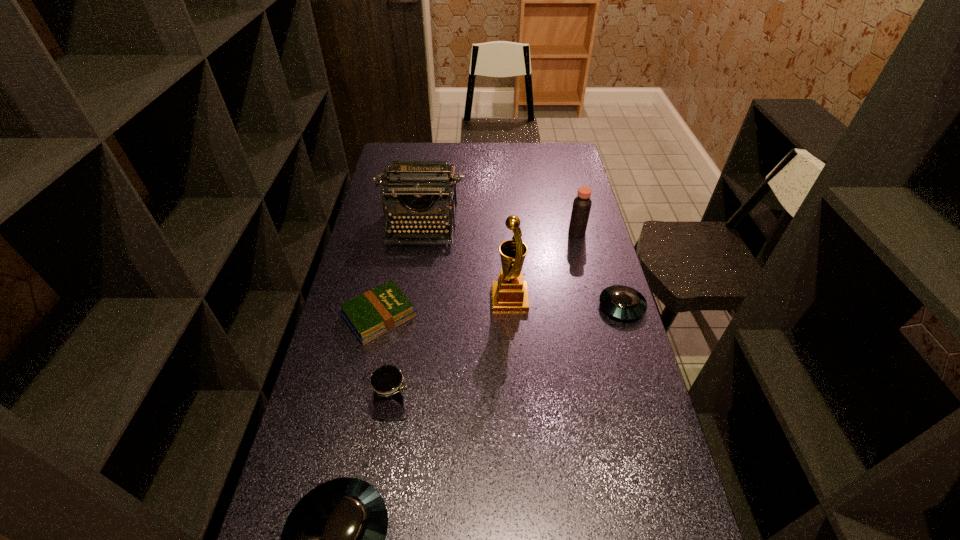
The image size is (960, 540). I want to click on free location located 0.400m on the front-facing side of the award, so click(x=370, y=299).

The width and height of the screenshot is (960, 540). I want to click on free space located on the front-facing side of the award, so click(x=431, y=299).

Locate an element on the screen. The image size is (960, 540). vacant space situated 0.210m on the front-facing side of the award is located at coordinates (428, 299).

Identify the location of free space located on the left of the vinegar. (524, 232).

Where is `free space located on the front of the book`? This screenshot has width=960, height=540. free space located on the front of the book is located at coordinates (366, 381).

The width and height of the screenshot is (960, 540). What are the coordinates of `free region located on the typing side of the typewriter` in the screenshot? It's located at coord(413,286).

Find the location of a particular element. Image resolution: width=960 pixels, height=540 pixels. free point located on the lid of the fourth tallest object is located at coordinates (444, 408).

I want to click on book at the left edge, so click(x=376, y=312).

Locate an element on the screen. typewriter that is at the left edge is located at coordinates (425, 191).

Find the location of a particular element. saucer that is at the right edge is located at coordinates (622, 302).